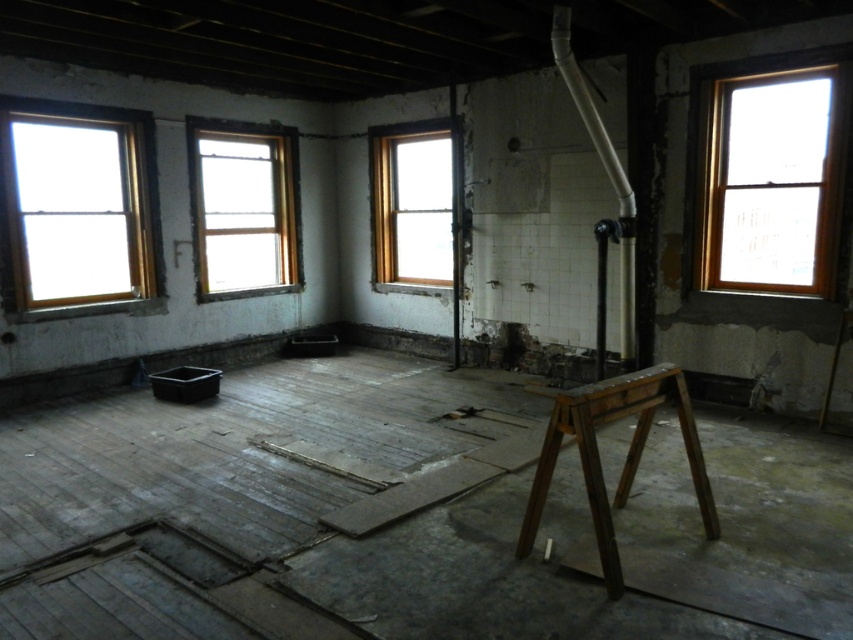
You are a contractor working in this room and need to move the dark brown wooden stool at center to the right side of the clear glass window at center. Is this possible given their current positions?

The clear glass window at center is positioned on the left side of the dark brown wooden stool at center. To move the dark brown wooden stool at center to the right side of the clear glass window at center, you would need to shift it to the left, which is feasible as long as there is enough space available in that direction.

You are an inspector checking the structural integrity of the windows in the renovation site. You notice two windows, the clear glass window at left and the clear glass window at center. Which window has a smaller area?

The clear glass window at left occupies less space than the clear glass window at center, so the clear glass window at left has a smaller area.

You are a contractor working in this room. You need to move the dark brown wooden stool at center to the other side of the room. The path is clear except for the clear glass window at center. Can the stool fit through the space next to the window without touching it?

The clear glass window at center has a larger size compared to dark brown wooden stool at center, so the stool can fit through the space next to the window without touching it.